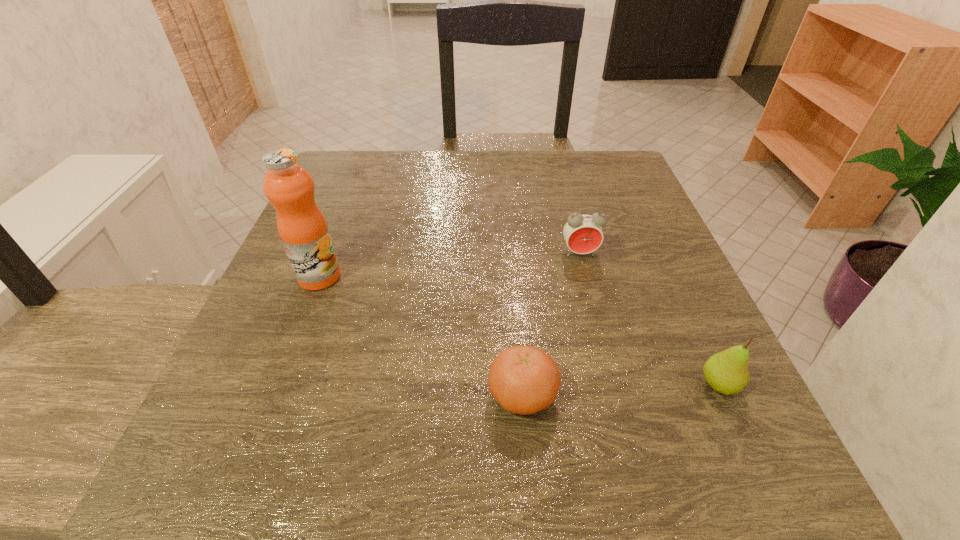
The width and height of the screenshot is (960, 540). What are the coordinates of `free space located on the right of the clementine` in the screenshot? It's located at (668, 395).

Where is `object that is at the left edge`? Image resolution: width=960 pixels, height=540 pixels. object that is at the left edge is located at coordinates (289, 187).

Locate an element on the screen. The height and width of the screenshot is (540, 960). alarm clock at the right edge is located at coordinates (583, 233).

Find the location of a particular element. pear that is at the right edge is located at coordinates [726, 372].

In the image, there is a desktop. Where is `vacant space at the far edge`? vacant space at the far edge is located at coordinates (406, 200).

Where is `free space at the near edge of the desktop`? The image size is (960, 540). free space at the near edge of the desktop is located at coordinates (417, 452).

This screenshot has height=540, width=960. In the image, there is a desktop. Find the location of `vacant space at the left edge`. vacant space at the left edge is located at coordinates (308, 430).

Find the location of a particular element. The height and width of the screenshot is (540, 960). free space at the right edge is located at coordinates (670, 242).

The height and width of the screenshot is (540, 960). I want to click on free space at the far left corner of the desktop, so click(384, 163).

What are the coordinates of `blank area at the far right corner` in the screenshot? It's located at (595, 191).